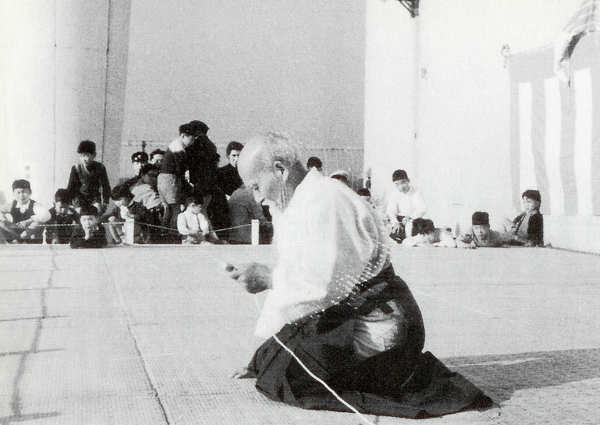
This screenshot has height=425, width=600. In order to click on wall in this screenshot , I will do `click(493, 127)`, `click(191, 85)`.